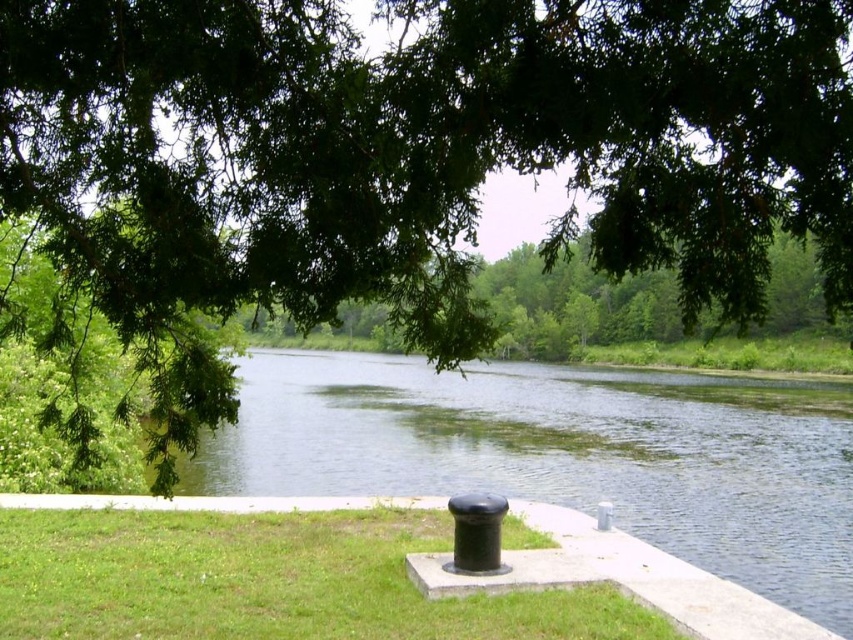
Question: Which of the following is the closest to the observer?

Choices:
 (A) (621, 508)
 (B) (381, 545)

Answer: (B)

Question: Can you confirm if green water at center is positioned above green grass at center?

Choices:
 (A) yes
 (B) no

Answer: (B)

Question: Does green water at center appear on the left side of green grass at center?

Choices:
 (A) yes
 (B) no

Answer: (B)

Question: Considering the relative positions of green water at center and green grass at center in the image provided, where is green water at center located with respect to green grass at center?

Choices:
 (A) below
 (B) above

Answer: (A)